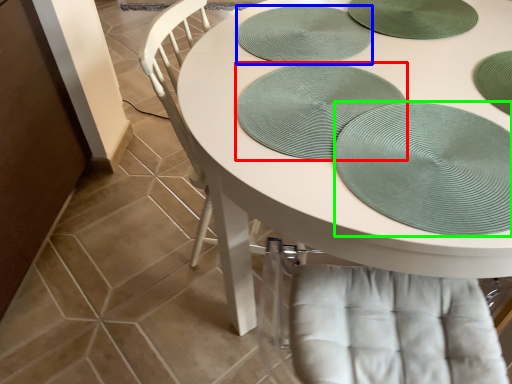
Question: Based on their relative distances, which object is nearer to platter (highlighted by a red box)? Choose from platter (highlighted by a blue box) and glass plate (highlighted by a green box).

Choices:
 (A) platter
 (B) glass plate

Answer: (B)